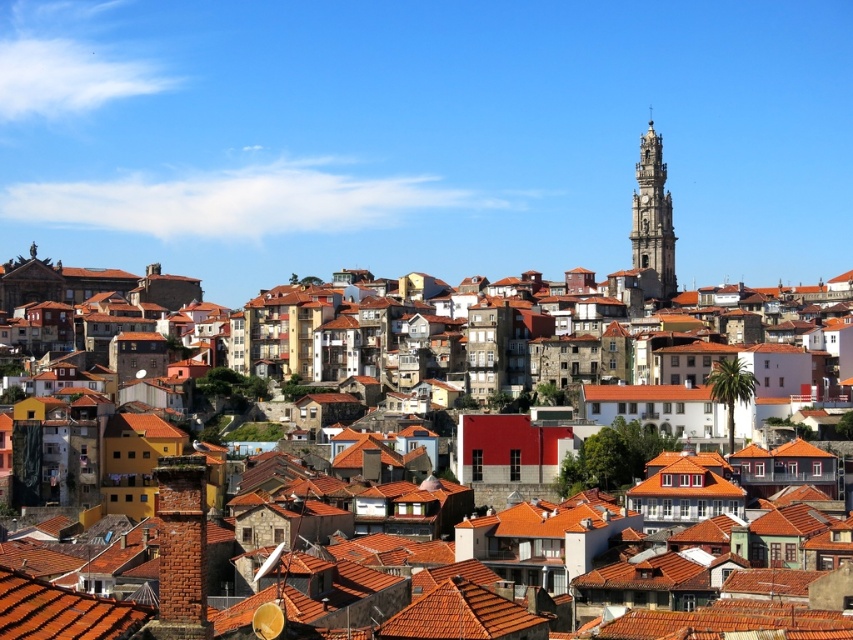
Is terracotta clay rooftops at center above golden stone tower at upper right?

Actually, terracotta clay rooftops at center is below golden stone tower at upper right.

Between point (537, 330) and point (659, 244), which one is positioned behind?

Positioned behind is point (659, 244).

Who is more distant from viewer, (726, 378) or (659, 224)?

The point (659, 224) is more distant.

Identify the location of terracotta clay rooftops at center. (345, 397).